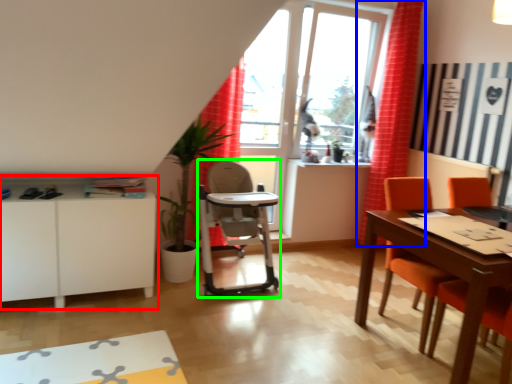
Question: Based on their relative distances, which object is nearer to cabinetry (highlighted by a red box)? Choose from curtain (highlighted by a blue box) and feeding chair (highlighted by a green box).

Choices:
 (A) curtain
 (B) feeding chair

Answer: (B)